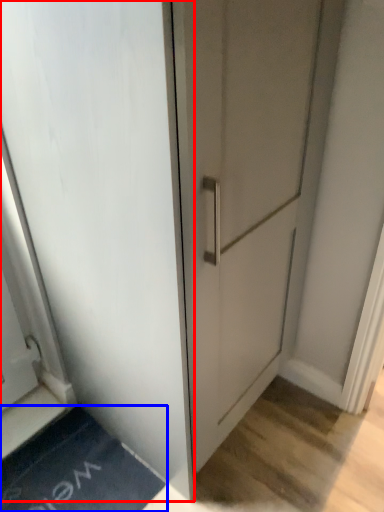
Question: Which object is closer to the camera taking this photo, door (highlighted by a red box) or bath mat (highlighted by a blue box)?

Choices:
 (A) door
 (B) bath mat

Answer: (A)